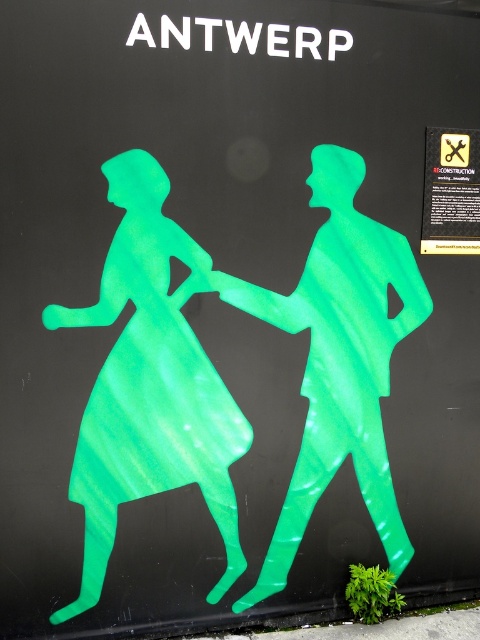
Does point (228, 440) come closer to viewer compared to point (321, 460)?

Yes, it is.

Who is positioned more to the right, green translucent figure at left or green translucent figure at center?

From the viewer's perspective, green translucent figure at center appears more on the right side.

Is point (232, 413) closer to camera compared to point (374, 444)?

Yes, it is.

Find the location of a particular element. green translucent figure at left is located at coordinates (149, 384).